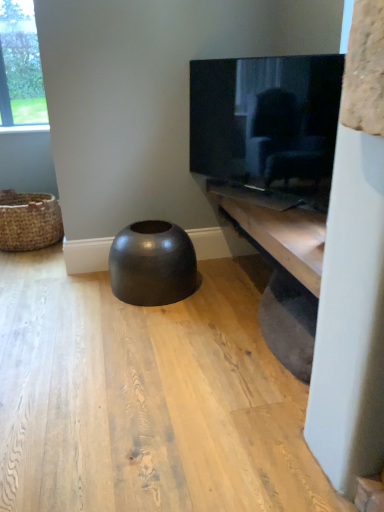
Question: Does matte black tv at upper right contain glossy black stool at center?

Choices:
 (A) no
 (B) yes

Answer: (A)

Question: Are matte black tv at upper right and glossy black stool at center making contact?

Choices:
 (A) no
 (B) yes

Answer: (A)

Question: Is matte black tv at upper right smaller than glossy black stool at center?

Choices:
 (A) no
 (B) yes

Answer: (B)

Question: Can you confirm if matte black tv at upper right is bigger than glossy black stool at center?

Choices:
 (A) no
 (B) yes

Answer: (A)

Question: Can you confirm if matte black tv at upper right is thinner than glossy black stool at center?

Choices:
 (A) no
 (B) yes

Answer: (B)

Question: In terms of width, does wooden shelf at lower right look wider or thinner when compared to glossy black stool at center?

Choices:
 (A) wide
 (B) thin

Answer: (B)

Question: Is wooden shelf at lower right situated inside glossy black stool at center or outside?

Choices:
 (A) outside
 (B) inside

Answer: (A)

Question: In terms of height, does wooden shelf at lower right look taller or shorter compared to glossy black stool at center?

Choices:
 (A) tall
 (B) short

Answer: (B)

Question: From a real-world perspective, is wooden shelf at lower right physically located above or below glossy black stool at center?

Choices:
 (A) below
 (B) above

Answer: (B)

Question: Is wooden shelf at lower right situated inside matte black tv at upper right or outside?

Choices:
 (A) outside
 (B) inside

Answer: (A)

Question: Considering the positions of wooden shelf at lower right and matte black tv at upper right in the image, is wooden shelf at lower right taller or shorter than matte black tv at upper right?

Choices:
 (A) short
 (B) tall

Answer: (A)

Question: In terms of size, does wooden shelf at lower right appear bigger or smaller than matte black tv at upper right?

Choices:
 (A) small
 (B) big

Answer: (B)

Question: From the image's perspective, is wooden shelf at lower right above or below matte black tv at upper right?

Choices:
 (A) above
 (B) below

Answer: (B)

Question: Considering the positions of point (223, 102) and point (258, 234), is point (223, 102) closer or farther from the camera than point (258, 234)?

Choices:
 (A) closer
 (B) farther

Answer: (B)

Question: In terms of height, does matte black tv at upper right look taller or shorter compared to wooden shelf at lower right?

Choices:
 (A) short
 (B) tall

Answer: (B)